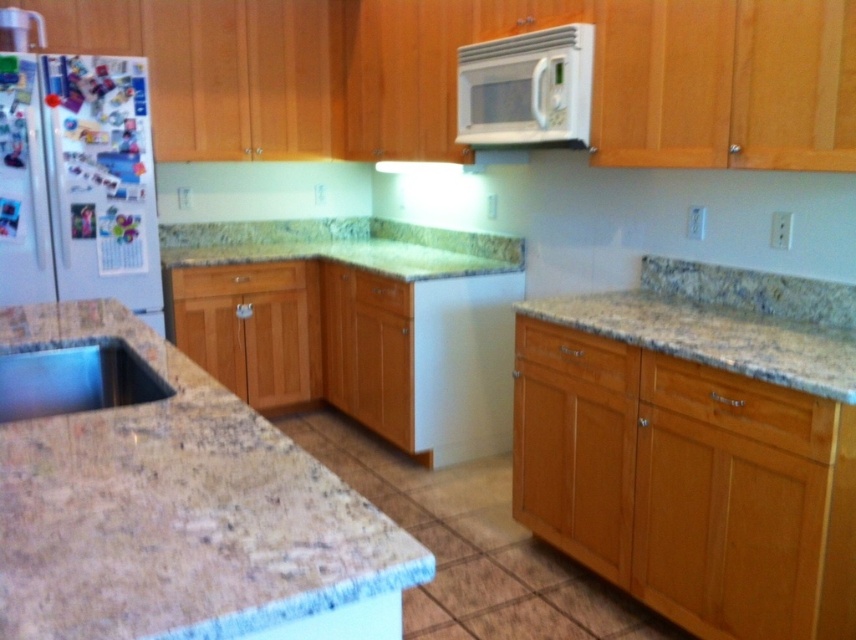
Question: Which of the following is the closest to the observer?

Choices:
 (A) (293, 506)
 (B) (16, 136)

Answer: (A)

Question: Can you confirm if granite countertop at lower left is bigger than white glossy refrigerator at left?

Choices:
 (A) no
 (B) yes

Answer: (B)

Question: Is granite countertop at lower left bigger than white glossy microwave at upper center?

Choices:
 (A) yes
 (B) no

Answer: (A)

Question: Does white glossy refrigerator at left have a lesser width compared to satin silver sink at lower left?

Choices:
 (A) no
 (B) yes

Answer: (A)

Question: Which of the following is the closest to the observer?

Choices:
 (A) (123, 243)
 (B) (171, 388)
 (C) (635, 298)
 (D) (180, 502)

Answer: (D)

Question: Among these points, which one is nearest to the camera?

Choices:
 (A) (122, 108)
 (B) (526, 300)

Answer: (A)